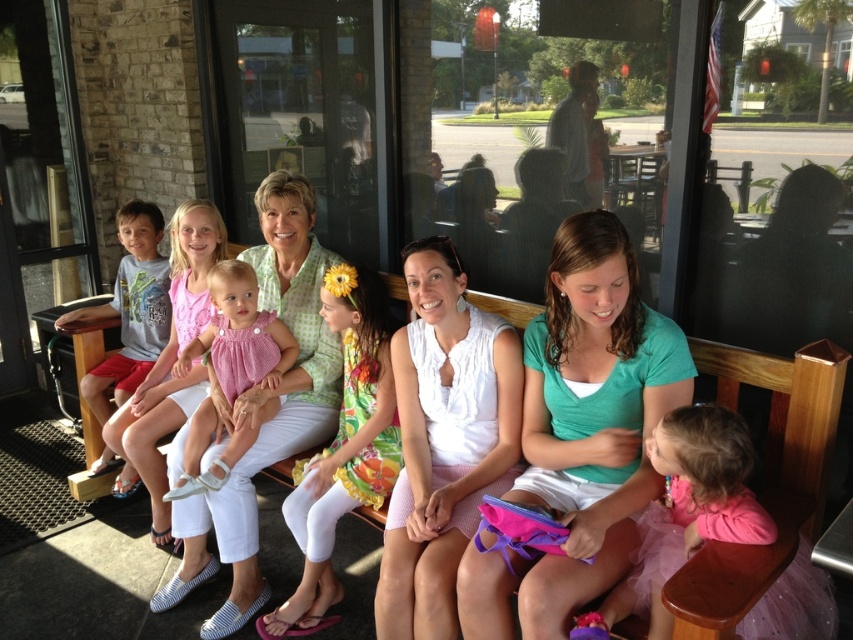
You are a photographer trying to capture a group photo of the two subjects wearing the green cotton shirt at center and the pink satin dress at center. Since you want to ensure both are visible in the frame, which one should you position closer to the camera to avoid being blocked by the other?

The green cotton shirt at center is taller than the pink satin dress at center, so you should position the pink satin dress at center closer to the camera to prevent the taller green cotton shirt at center from blocking it.

You are a photographer trying to capture a closeup of the white fabric dress at center without the green cotton shirt at center blocking it. What should you do?

The green cotton shirt at center is positioned over the white fabric dress at center, so you should adjust your angle or move slightly to the side to avoid the obstruction.

You are a photographer setting up a camera to capture the group on the wooden bench. You need to ensure both the green cotton shirt at center and the pink satin dress at center are in focus. Based on their positions, which object should you adjust the camera focus towards first?

The green cotton shirt at center might be wider than pink satin dress at center, so you should focus on the green cotton shirt at center first to ensure it is in focus before adjusting for the pink satin dress at center.